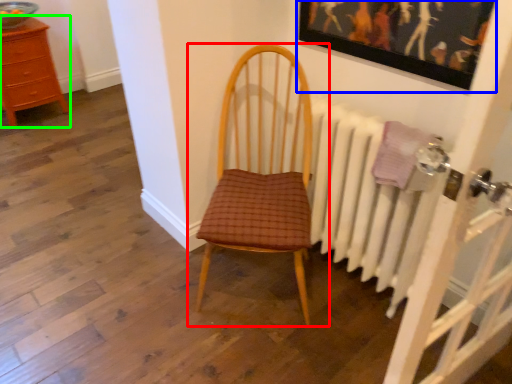
Question: Considering the real-world distances, which object is farthest from chair (highlighted by a red box)? picture frame (highlighted by a blue box) or chest of drawers (highlighted by a green box)?

Choices:
 (A) picture frame
 (B) chest of drawers

Answer: (B)